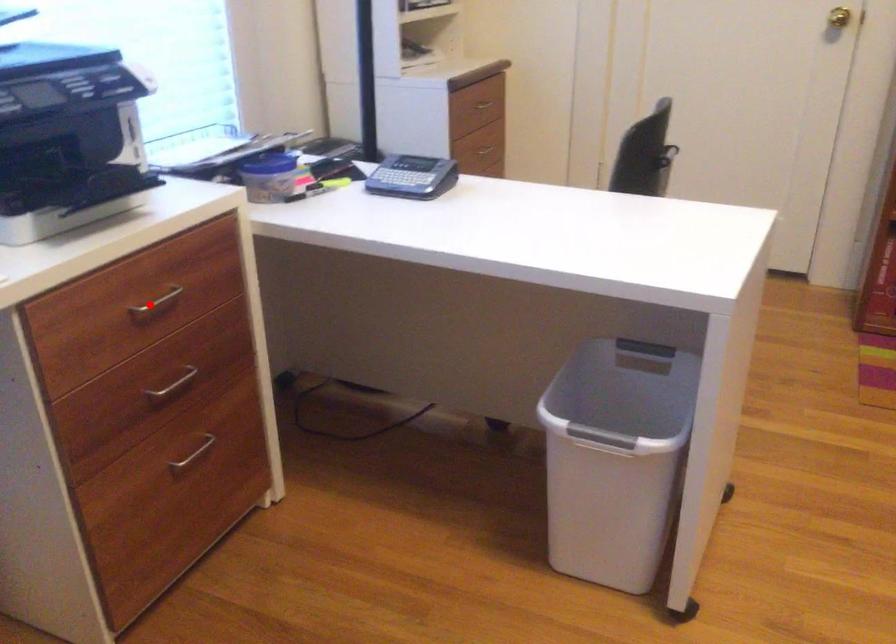
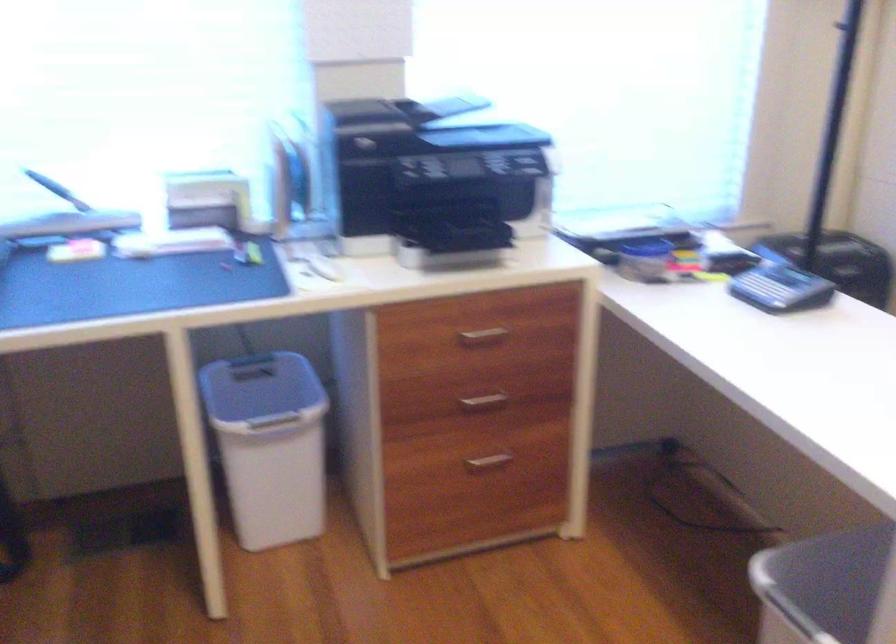
Locate, in the second image, the point that corresponds to the highlighted location in the first image.

(483, 334)